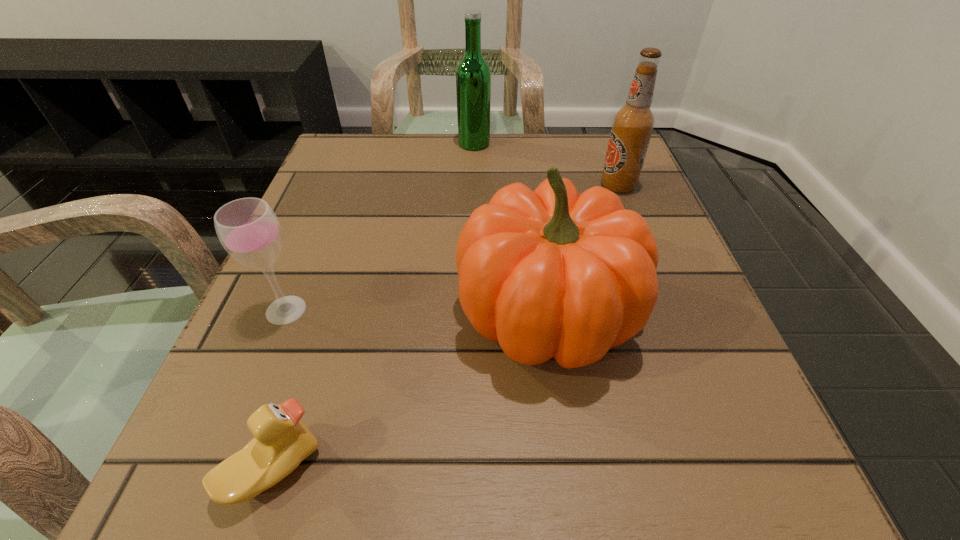
At what (x,y) coordinates should I click in order to perform the action: click on vacant space located 0.340m on the front label of the right beer bottle. Please return your answer as a coordinate pair (x, y). Looking at the image, I should click on (438, 186).

The image size is (960, 540). I want to click on vacant space located 0.270m on the front label of the right beer bottle, so click(471, 186).

I want to click on vacant space located 0.070m on the left of the pumpkin, so click(413, 313).

Where is `free space located 0.160m on the back of the second shortest object`? Image resolution: width=960 pixels, height=540 pixels. free space located 0.160m on the back of the second shortest object is located at coordinates (319, 230).

Image resolution: width=960 pixels, height=540 pixels. I want to click on vacant space located 0.310m at the beak of the nearest object, so click(584, 469).

Find the location of a particular element. The image size is (960, 540). object at the near edge is located at coordinates (281, 441).

This screenshot has height=540, width=960. I want to click on wineglass located in the left edge section of the desktop, so click(x=248, y=229).

Identify the location of duck present at the left edge. The image size is (960, 540). (281, 441).

This screenshot has width=960, height=540. I want to click on beer bottle located in the right edge section of the desktop, so click(632, 126).

Where is `pumpkin at the right edge`? This screenshot has width=960, height=540. pumpkin at the right edge is located at coordinates (549, 273).